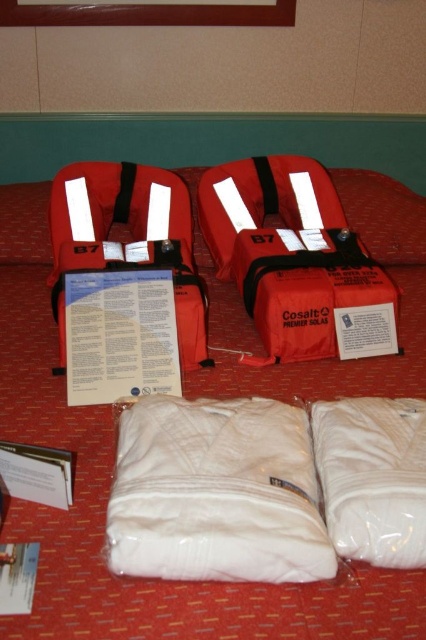
You are packing a survival kit and need to decide which item to prioritize based on size. The matte red life jackets at center and the white cotton sleeping bag at lower center are both available. Which item should you choose if you want to take the larger one?

The matte red life jackets at center has a larger size compared to the white cotton sleeping bag at lower center, so you should choose the matte red life jackets at center.

You are an inspector checking the layout of the display. The display area has a coordinate system where the bottom left corner is the origin. The life jackets must be placed within the central zone defined by coordinates between 0.4 and 0.6 on both axes. Are the matte red life jackets at center positioned correctly according to the requirements?

The 2D location of matte red life jackets at center is at point (106, 499). Since the central zone requires coordinates between 0.4 and 0.6 on both axes, the life jackets are outside the central zone because their x and y coordinates are beyond the specified range. Therefore, they are not positioned correctly according to the requirements.

You are a safety inspector checking the storage of emergency equipment. You see the white cotton sleeping bag at lower center and the matte orange life jacket at center. According to safety regulations, emergency life jackets must always be placed above sleeping bags to ensure quick access during emergencies. Does the current arrangement comply with the regulation?

The white cotton sleeping bag at lower center is below the matte orange life jacket at center, so the arrangement complies with the regulation since the life jacket is positioned above the sleeping bag for quick access.